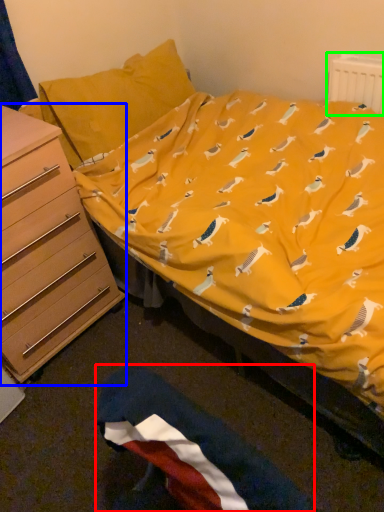
Question: Which object is the closest to the flag (highlighted by a red box)? Choose among these: chest of drawers (highlighted by a blue box) or radiator (highlighted by a green box).

Choices:
 (A) chest of drawers
 (B) radiator

Answer: (A)